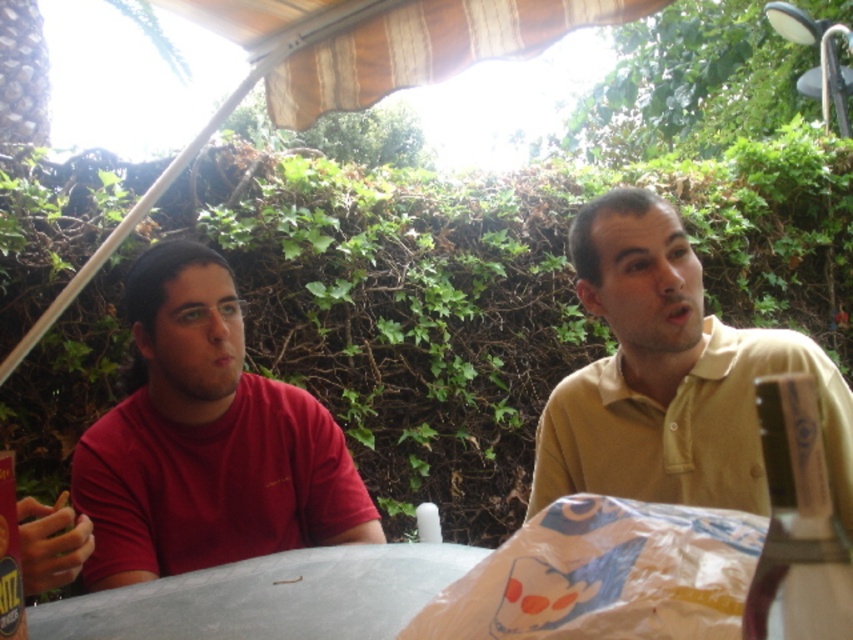
You are setting up a picnic and need to place a metallic can at left and a wooden box at lower right. Given their sizes, which object should you choose to store snacks if you have a larger quantity?

The wooden box at lower right has a larger width than the metallic can at left, so it can store more snacks.

You are standing in the garden and want to walk from point A to point B. Point A is at coordinates point (198, 336) and point B is at coordinates point (776, 492). Which point is closer to you when you start walking?

Point A at coordinates point (198, 336) is closer to you than point B at coordinates point (776, 492) because it is further to the viewer.